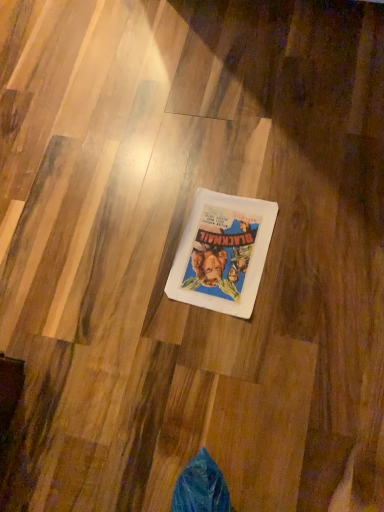
Where is `vacant location below white matte book cover at center (from a real-world perspective)`? This screenshot has width=384, height=512. vacant location below white matte book cover at center (from a real-world perspective) is located at coordinates (222, 250).